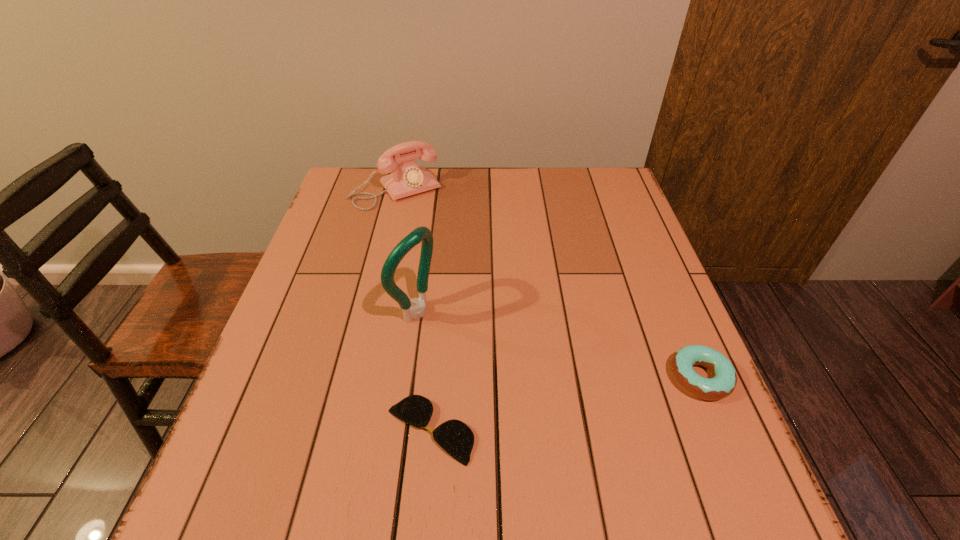
Locate an element on the screen. The width and height of the screenshot is (960, 540). empty space between the second shortest object and the tallest object is located at coordinates (558, 345).

You are a GUI agent. You are given a task and a screenshot of the screen. Output one action in this format:
    pyautogui.click(x=<x>, y=<y>)
    Task: Click on the vacant space that is in between the tallest object and the spectacles
    Image resolution: width=960 pixels, height=540 pixels.
    Given the screenshot: What is the action you would take?
    pyautogui.click(x=423, y=371)

Choose which object is the third nearest neighbor to the second tallest object. Please provide its 2D coordinates. Your answer should be formatted as a tuple, i.e. [(x, y)], where the tuple contains the x and y coordinates of a point satisfying the conditions above.

[(723, 383)]

Identify the location of object that is the second closest to the bottle opener. (409, 178).

In order to click on free space in the image that satisfies the following two spatial constraints: 1. on the front side of the tallest object; 2. on the right side of the rightmost object in this screenshot , I will do `click(407, 377)`.

I want to click on free space that satisfies the following two spatial constraints: 1. on the front side of the second farthest object; 2. on the left side of the spectacles, so click(399, 430).

In order to click on free location that satisfies the following two spatial constraints: 1. on the front side of the shortest object; 2. on the right side of the third nearest object in this screenshot , I will do `click(399, 430)`.